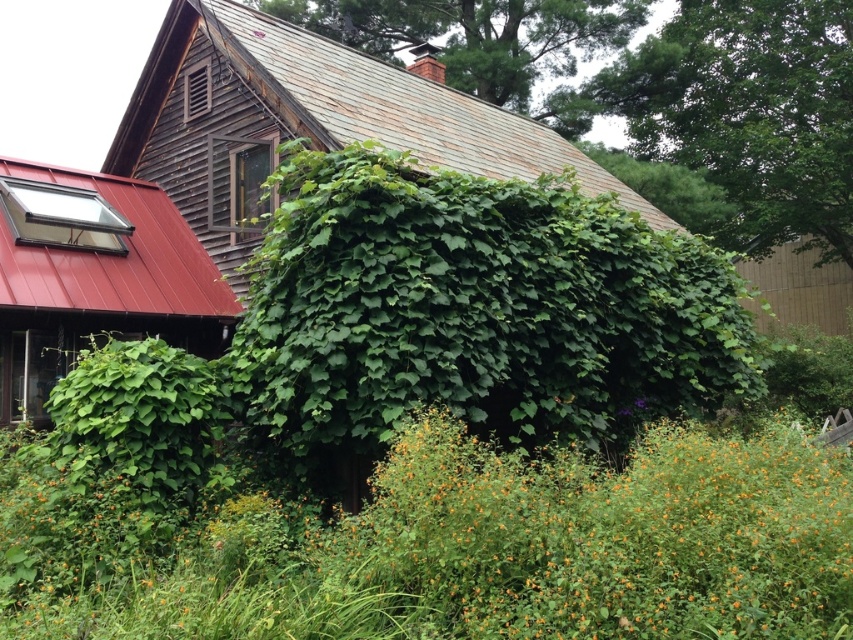
Question: Estimate the real-world distances between objects in this image. Which object is closer to the wooden fence at right?

Choices:
 (A) metallic red awning at left
 (B) green leafy vines at upper center
 (C) green leafy bush at center

Answer: (B)

Question: Which of the following is the farthest from the observer?

Choices:
 (A) green leafy plant at upper center
 (B) green leafy plant at upper right

Answer: (B)

Question: Does green leafy bush at center have a greater width compared to wooden fence at right?

Choices:
 (A) no
 (B) yes

Answer: (A)

Question: Is green leafy vines at upper center further to camera compared to metallic red awning at left?

Choices:
 (A) no
 (B) yes

Answer: (A)

Question: Which object appears closest to the camera in this image?

Choices:
 (A) wooden fence at right
 (B) metallic red awning at left
 (C) green leafy plant at upper right
 (D) green leafy plant at upper center

Answer: (B)

Question: Is green leafy vines at upper center above green leafy plant at upper center?

Choices:
 (A) no
 (B) yes

Answer: (A)